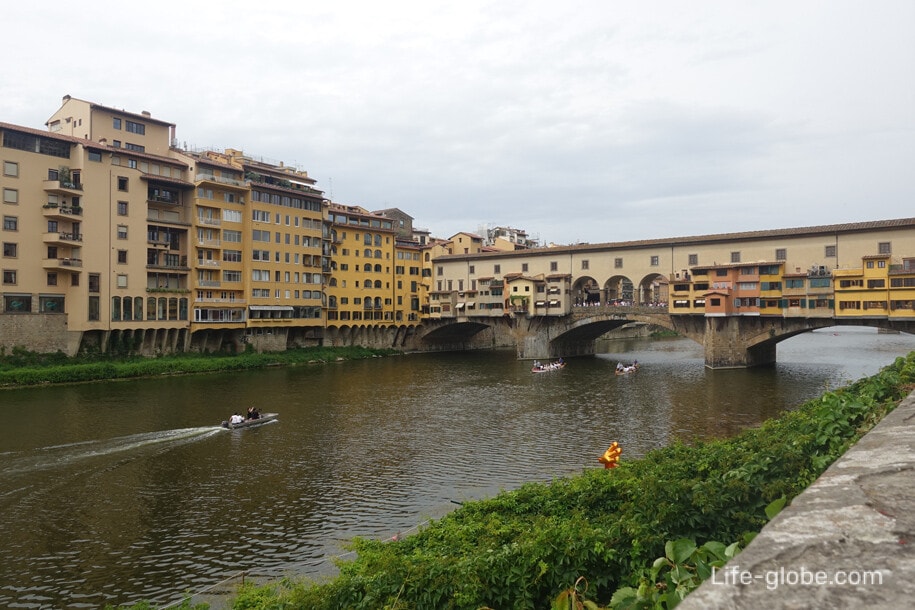
Locate an element on the screen. The width and height of the screenshot is (915, 610). archway is located at coordinates (471, 332), (655, 339), (869, 339).